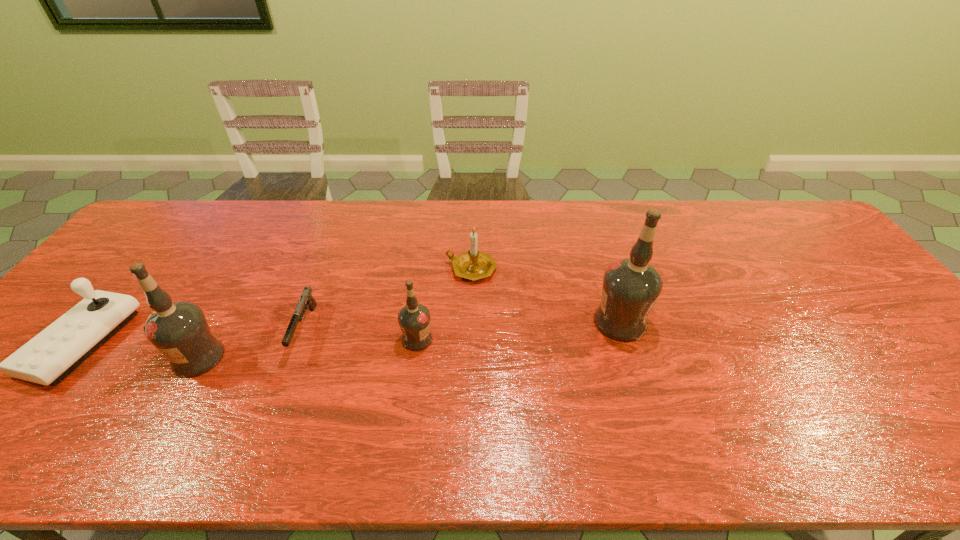
Identify the location of free point that keeps the vodkas evenly spaced on the right. (808, 306).